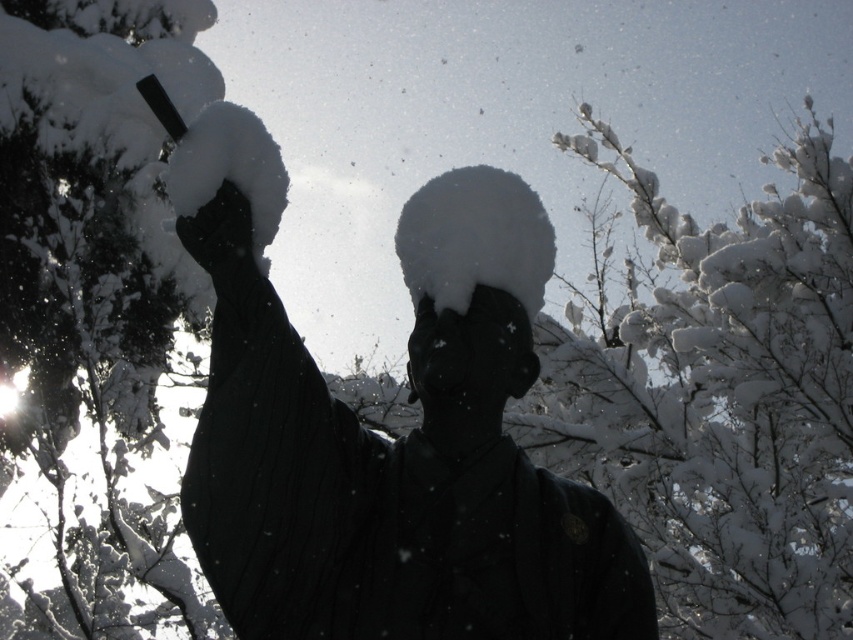
Which is more to the left, black matte statue at center or black matte hand at upper left?

black matte hand at upper left is more to the left.

This screenshot has height=640, width=853. In order to click on black matte statue at center in this screenshot , I will do `click(405, 460)`.

Can you confirm if snowy branches at upper right is positioned to the right of white snow-covered head at center?

Correct, you'll find snowy branches at upper right to the right of white snow-covered head at center.

Is snowy branches at upper right behind white snow-covered head at center?

Yes, snowy branches at upper right is further from the viewer.

Which is in front, point (589, 310) or point (492, 241)?

Point (492, 241)

Find the location of a particular element. The image size is (853, 640). snowy branches at upper right is located at coordinates (717, 394).

Does black matte statue at center appear over snow-covered branch at upper left?

No.

Does black matte statue at center have a lesser width compared to snow-covered branch at upper left?

Yes.

Measure the distance between black matte statue at center and camera.

black matte statue at center and camera are 10.99 feet apart from each other.

You are a GUI agent. You are given a task and a screenshot of the screen. Output one action in this format:
    pyautogui.click(x=<x>, y=<y>)
    Task: Click on the black matte statue at center
    
    Given the screenshot: What is the action you would take?
    pyautogui.click(x=405, y=460)